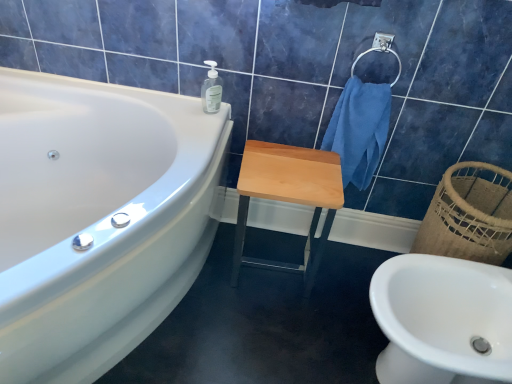
You are a GUI agent. You are given a task and a screenshot of the screen. Output one action in this format:
    pyautogui.click(x=<x>, y=<y>)
    Task: Click on the free space below light wood/matte stool at center (from a real-world perspective)
    This screenshot has height=384, width=512.
    Given the screenshot: What is the action you would take?
    pyautogui.click(x=277, y=267)